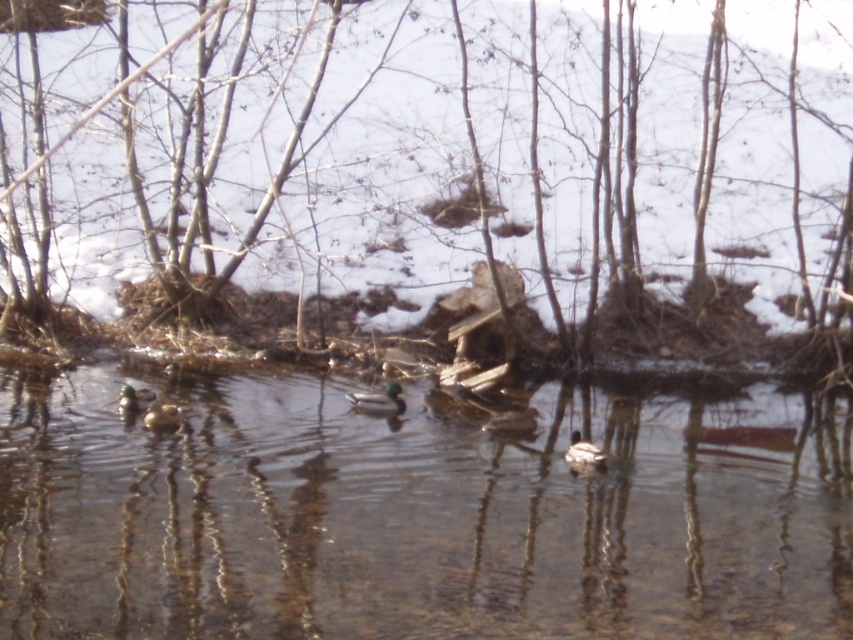
Consider the image. You are standing on the bank of the pond and see the brown wood at center and the brown matte duck at lower left. Which object is closer to your right side?

The brown wood at center is to the right of the brown matte duck at lower left, so the brown wood at center is closer to your right side.

You are a birdwatcher observing the ducks in the winter scene. You notice two ducks near the logs and branches. Which duck is located to the right of the other? The green matte duck at center or the green glossy duck at lower left?

The green matte duck at center is positioned on the right side of the green glossy duck at lower left.